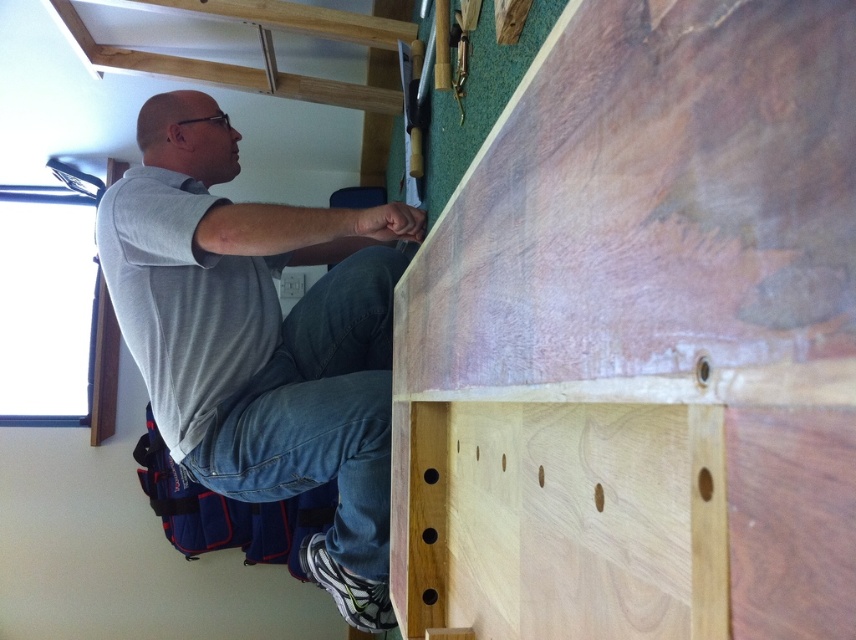
Question: Is natural wood plywood at center positioned at the back of gray cotton shirt at upper left?

Choices:
 (A) yes
 (B) no

Answer: (B)

Question: Which point is farther from the camera taking this photo?

Choices:
 (A) (220, 387)
 (B) (664, 291)

Answer: (A)

Question: Can you confirm if natural wood plywood at center is positioned to the right of gray cotton shirt at upper left?

Choices:
 (A) yes
 (B) no

Answer: (A)

Question: Is natural wood plywood at center bigger than gray cotton shirt at upper left?

Choices:
 (A) yes
 (B) no

Answer: (B)